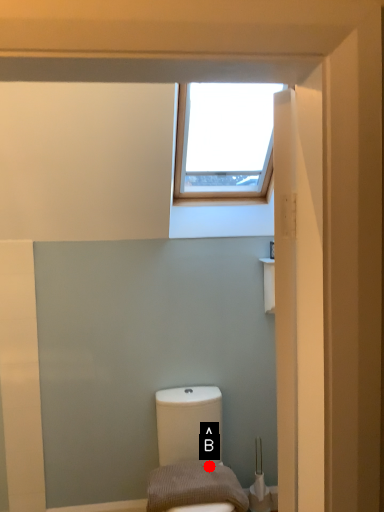
Question: Two points are circled on the image, labeled by A and B beside each circle. Which point is closer to the camera?

Choices:
 (A) A is closer
 (B) B is closer

Answer: (B)